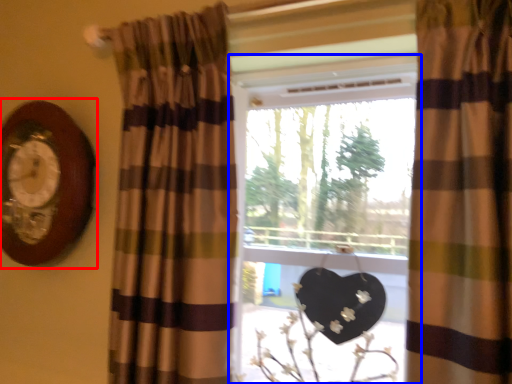
Question: Among these objects, which one is nearest to the camera, clock (highlighted by a red box) or window (highlighted by a blue box)?

Choices:
 (A) clock
 (B) window

Answer: (B)